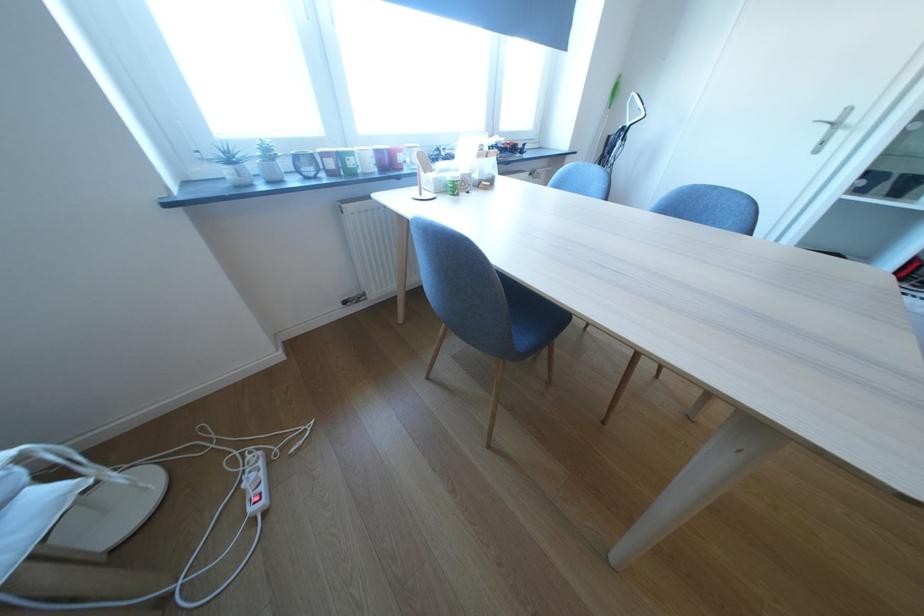
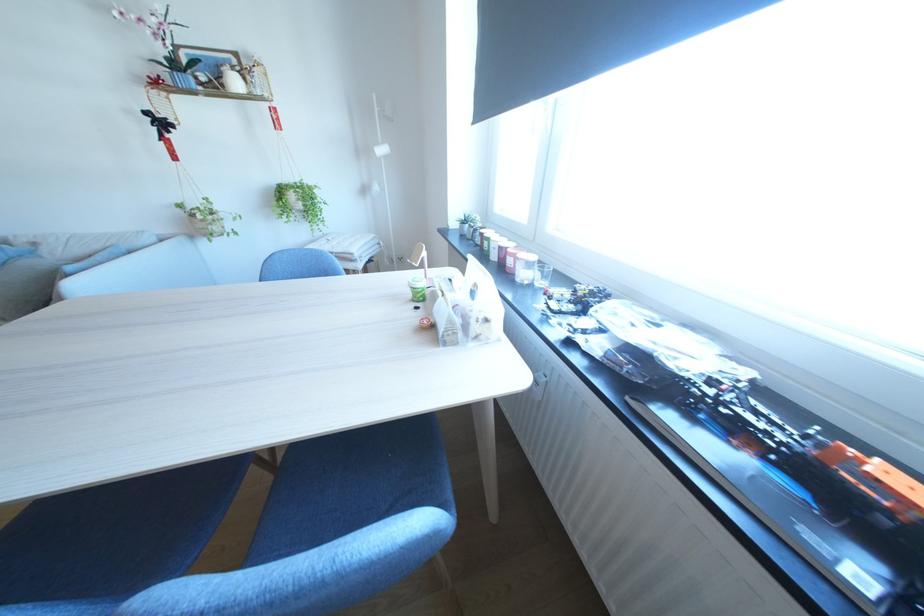
In the second image, find the point that corresponds to (493,147) in the first image.

(489, 288)